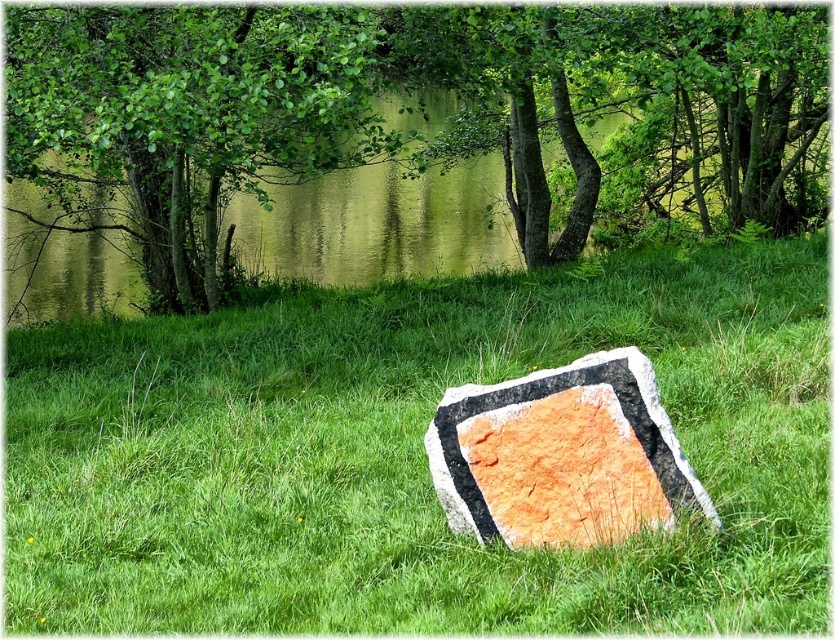
Question: Observing the image, what is the correct spatial positioning of green leafy tree at upper center in reference to orange textured stone at center?

Choices:
 (A) below
 (B) above

Answer: (B)

Question: Which object is the closest to the orange textured stone at center?

Choices:
 (A) orange stone at center
 (B) green leafy tree at upper center

Answer: (A)

Question: Can you confirm if orange stone at center is positioned above green leafy tree at upper left?

Choices:
 (A) no
 (B) yes

Answer: (A)

Question: Is orange stone at center thinner than green leafy tree at upper center?

Choices:
 (A) yes
 (B) no

Answer: (A)

Question: Estimate the real-world distances between objects in this image. Which object is farther from the orange stone at center?

Choices:
 (A) orange textured stone at center
 (B) green leafy tree at upper center
 (C) green leafy tree at upper left

Answer: (B)

Question: Which point is farther to the camera?

Choices:
 (A) (249, 22)
 (B) (529, 337)
 (C) (603, 401)
 (D) (760, 113)

Answer: (D)